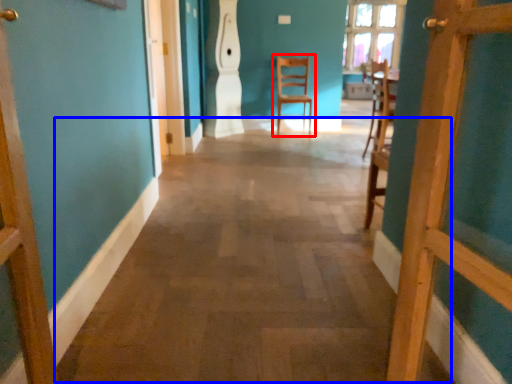
Question: Which of the following is the closest to the observer, chair (highlighted by a red box) or alley (highlighted by a blue box)?

Choices:
 (A) chair
 (B) alley

Answer: (B)